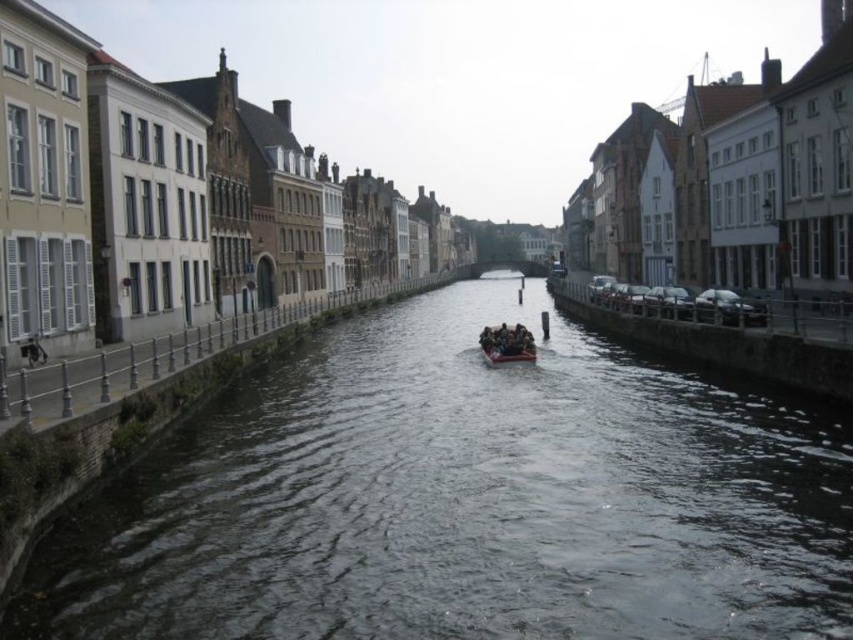
You are a tourist standing on the canal bridge. You see the dark water at center and the brown wooden raft at center. Which one is wider?

The dark water at center is wider than the brown wooden raft at center.

You are standing on a bridge overlooking the dark water at center. Your friend is on the other side of the canal, 50 meters away from you. Can you hear them if they shout?

The dark water at center is 45.88 meters from viewer. Since your friend is 50 meters away, which is slightly farther than the distance to the water, you might have difficulty hearing them clearly due to the distance and possible water noise.

You are standing on the bridge overlooking the dark water at center and the brown wooden raft at center. Which object is closer to you?

The dark water at center is closer to you because it is in front of the brown wooden raft at center.